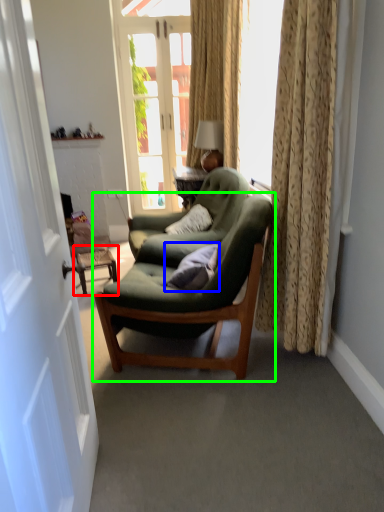
Question: Which object is the closest to the side table (highlighted by a red box)? Choose among these: pillow (highlighted by a blue box) or chair (highlighted by a green box).

Choices:
 (A) pillow
 (B) chair

Answer: (B)